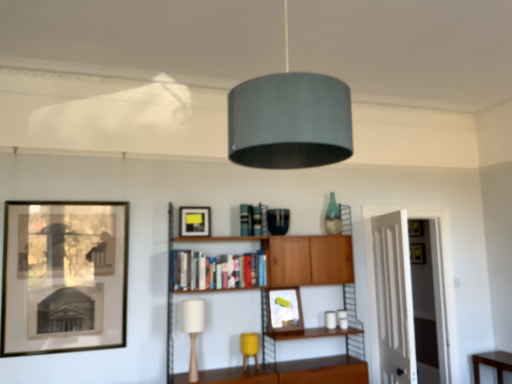
Find the location of a particular element. This screenshot has width=512, height=384. empty space that is ontop of matte black picture frame at left, which is the 3th picture frame in back-to-front order is located at coordinates (67, 199).